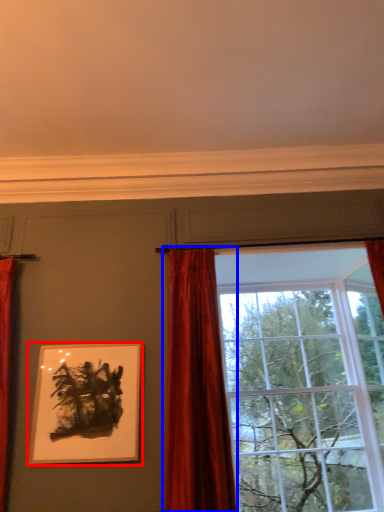
Question: Which object appears closest to the camera in this image, picture frame (highlighted by a red box) or curtain (highlighted by a blue box)?

Choices:
 (A) picture frame
 (B) curtain

Answer: (B)